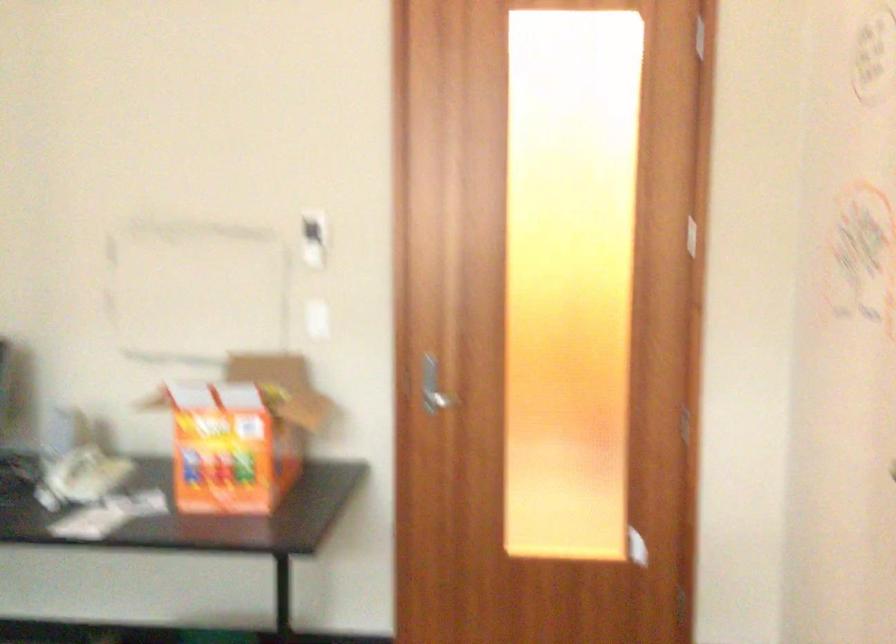
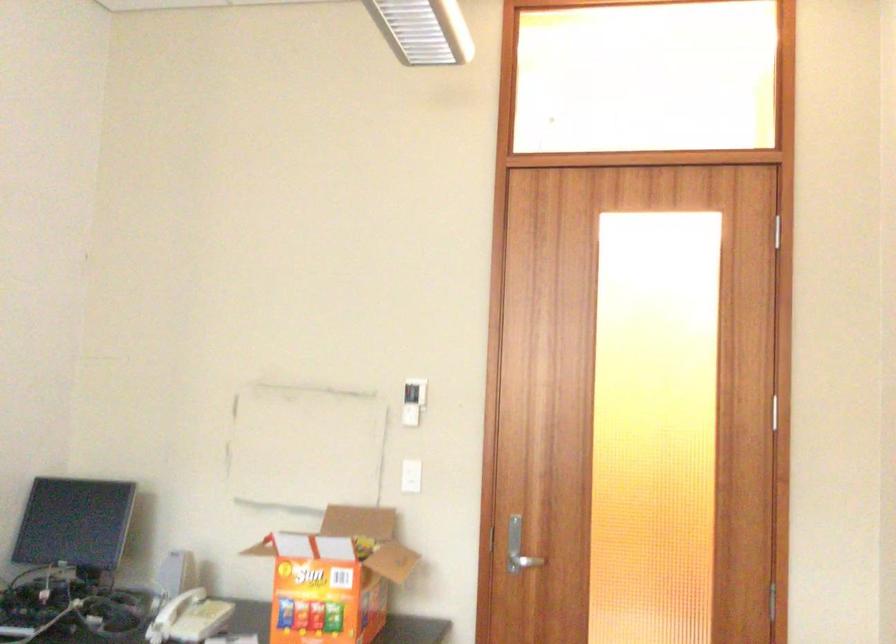
Locate, in the second image, the point that corresponds to (x=436, y=399) in the first image.

(523, 562)